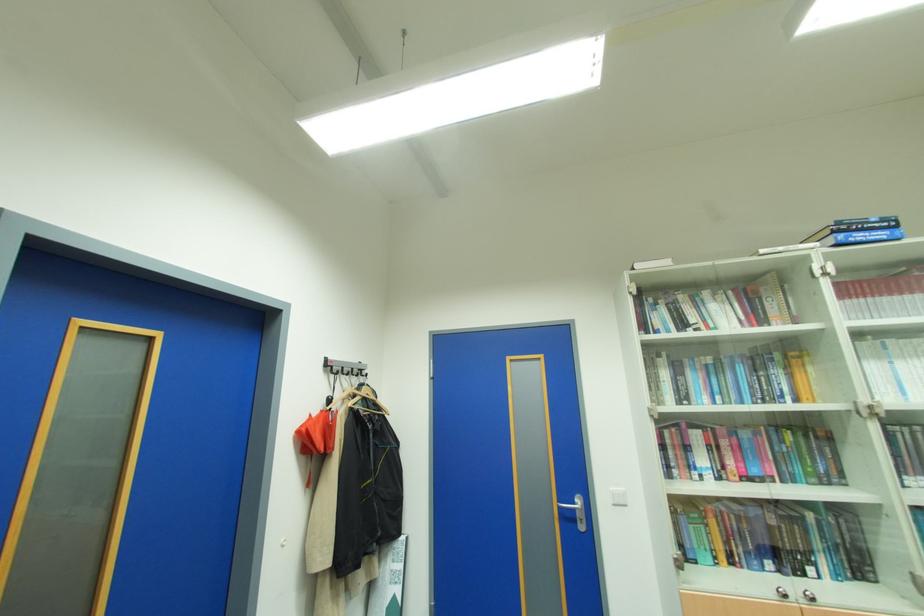
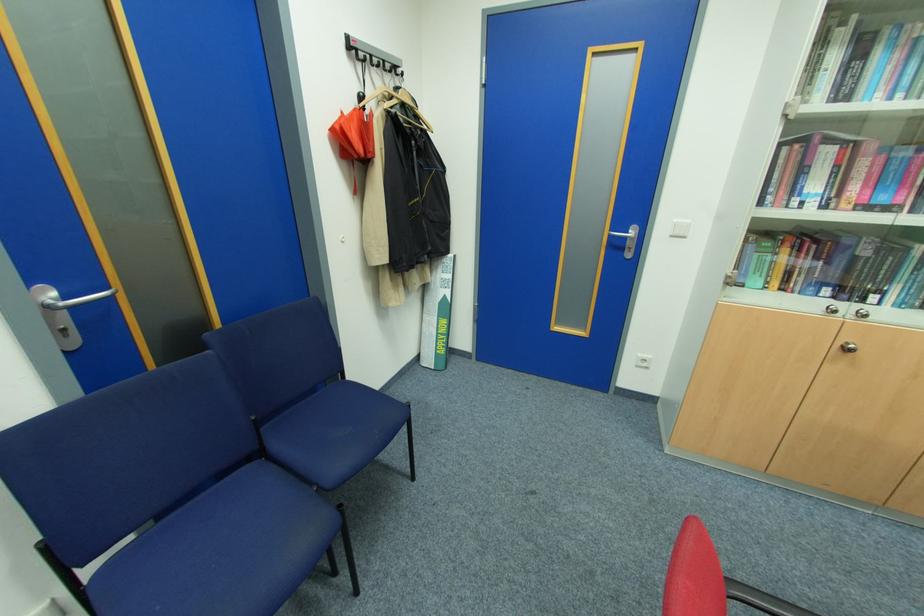
In the second image, find the point that corresponds to [578,504] in the first image.

(630, 233)